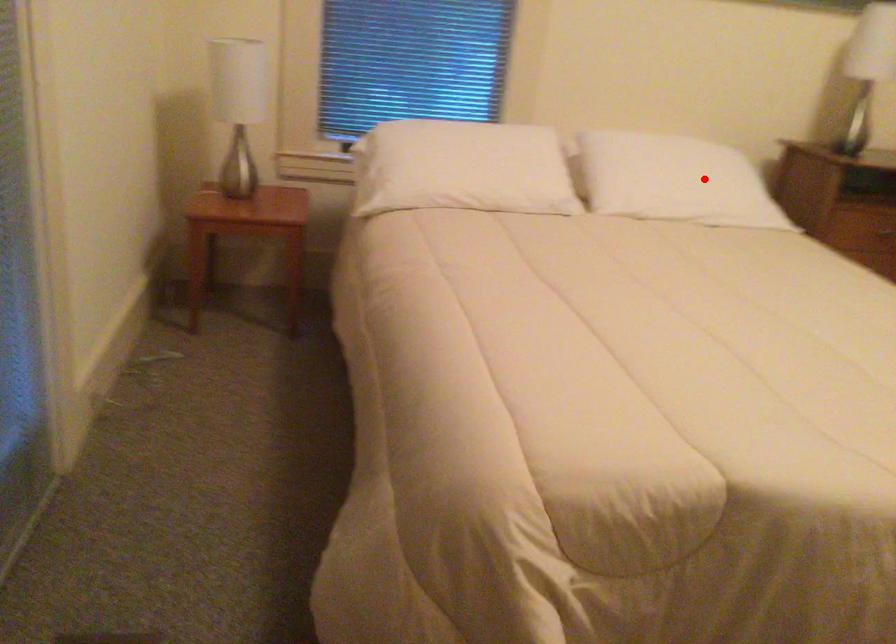
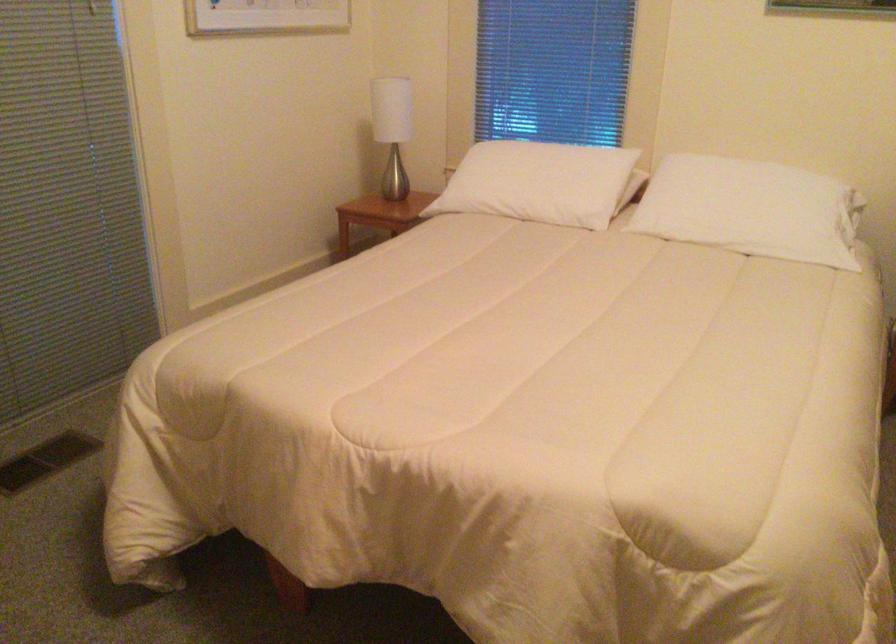
Locate, in the second image, the point that corresponds to the highlighted location in the first image.

(752, 210)